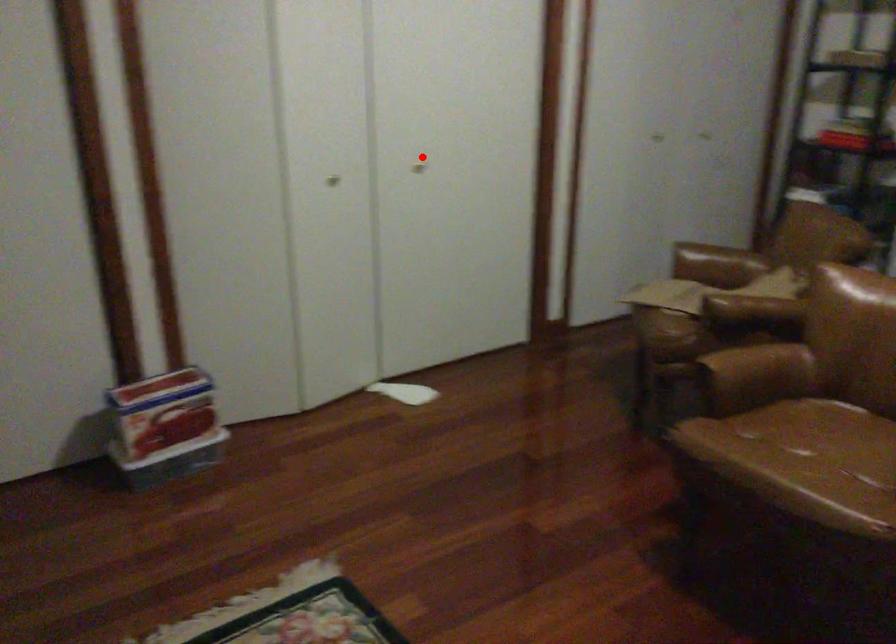
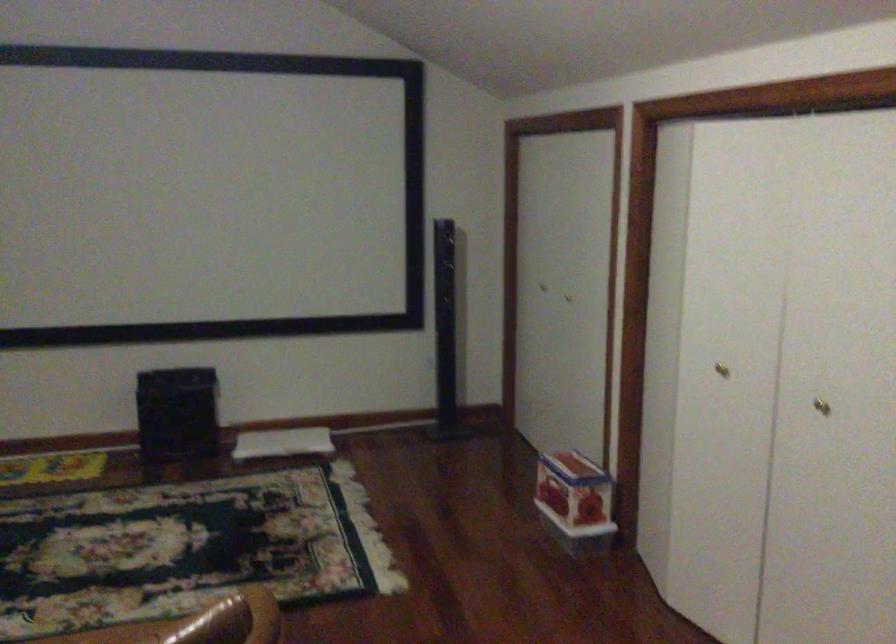
Question: I am providing you with two images of the same scene from different viewpoints. In image1, a red point is highlighted. Considering the same 3D point in image2, which of the following is correct?

Choices:
 (A) It is closer
 (B) It is farther

Answer: (A)